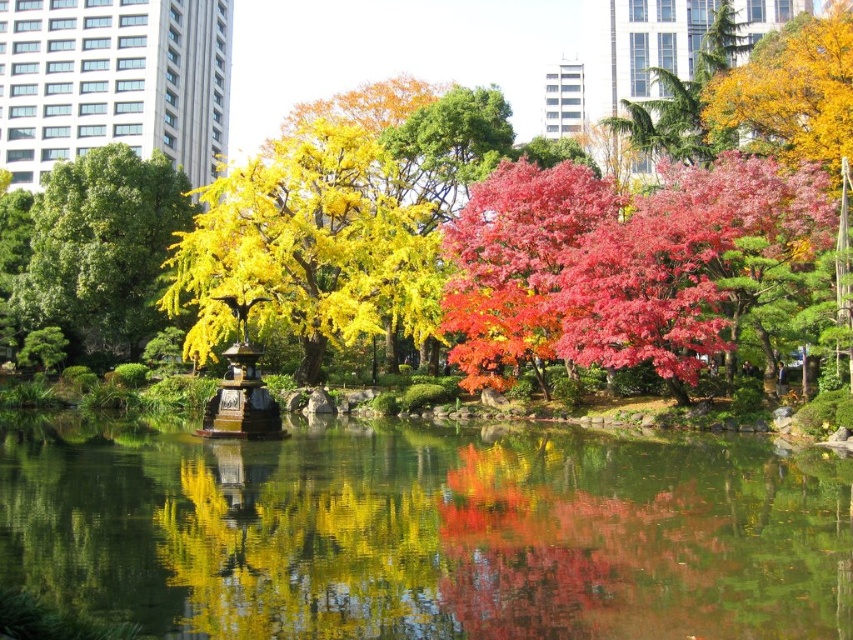
Question: Where is green reflective water at center located in relation to pink glossy maple at center right in the image?

Choices:
 (A) below
 (B) above

Answer: (A)

Question: Does green reflective water at center appear on the left side of pink glossy maple at center right?

Choices:
 (A) no
 (B) yes

Answer: (B)

Question: Which object is positioned farthest from the green reflective water at center?

Choices:
 (A) green leafy tree at left
 (B) pink glossy maple at center right
 (C) golden yellow leaves at center

Answer: (A)

Question: From the image, what is the correct spatial relationship of pink glossy maple at center right in relation to golden yellow leaves at center?

Choices:
 (A) left
 (B) right

Answer: (B)

Question: Which object is the farthest from the pink glossy maple at center right?

Choices:
 (A) green reflective water at center
 (B) green leafy tree at left
 (C) golden yellow leaves at center

Answer: (B)

Question: Which of these objects is positioned closest to the golden yellow leaves at center?

Choices:
 (A) green leafy tree at left
 (B) pink glossy maple at center right
 (C) green reflective water at center

Answer: (A)